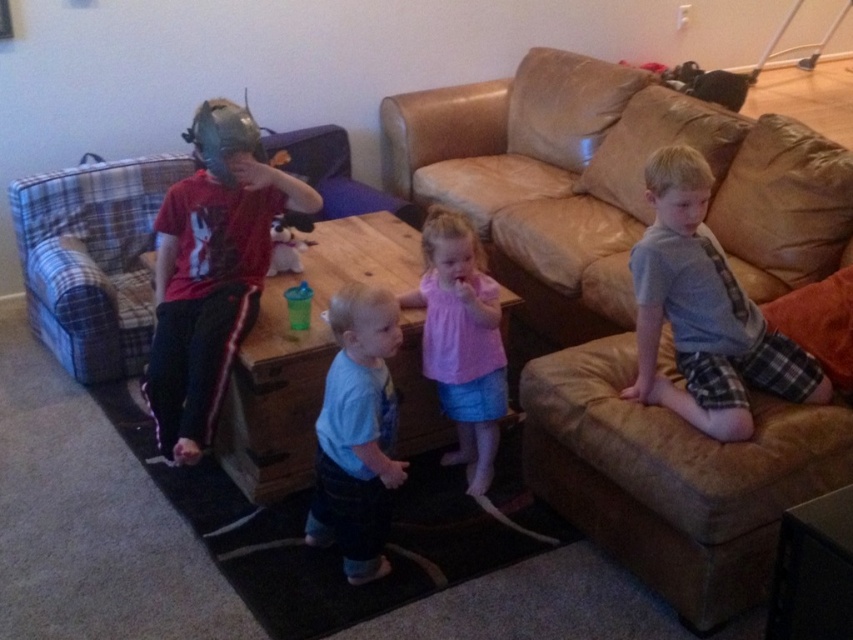
Question: Is brown leather couch at upper right bigger than blue plaid couch at left?

Choices:
 (A) no
 (B) yes

Answer: (B)

Question: Which of the following is the farthest from the observer?

Choices:
 (A) (318, 198)
 (B) (102, 332)
 (C) (680, 268)
 (D) (412, 176)

Answer: (D)

Question: Is brown leather couch at upper right behind gray flannel shirt at right?

Choices:
 (A) no
 (B) yes

Answer: (B)

Question: Which object is farther from the camera taking this photo?

Choices:
 (A) pink cotton shirt at center
 (B) brown leather couch at upper right
 (C) gray flannel shirt at right

Answer: (B)

Question: Among these points, which one is farthest from the camera?

Choices:
 (A) (483, 138)
 (B) (450, 328)

Answer: (A)

Question: Is brown leather couch at upper right below matte red shirt at left?

Choices:
 (A) yes
 (B) no

Answer: (B)